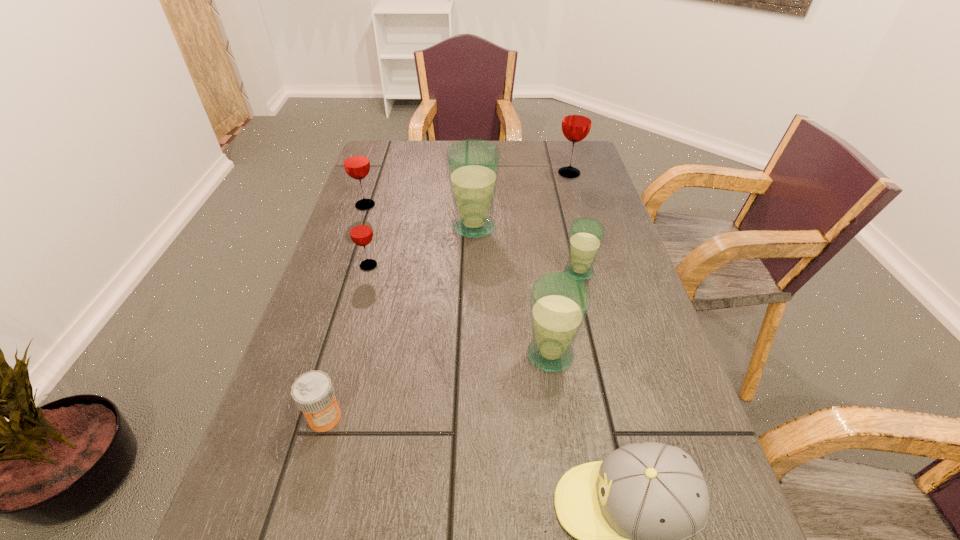
Locate an element on the screen. blue glass object that ranks as the third closest to the nearest red glass is located at coordinates (586, 234).